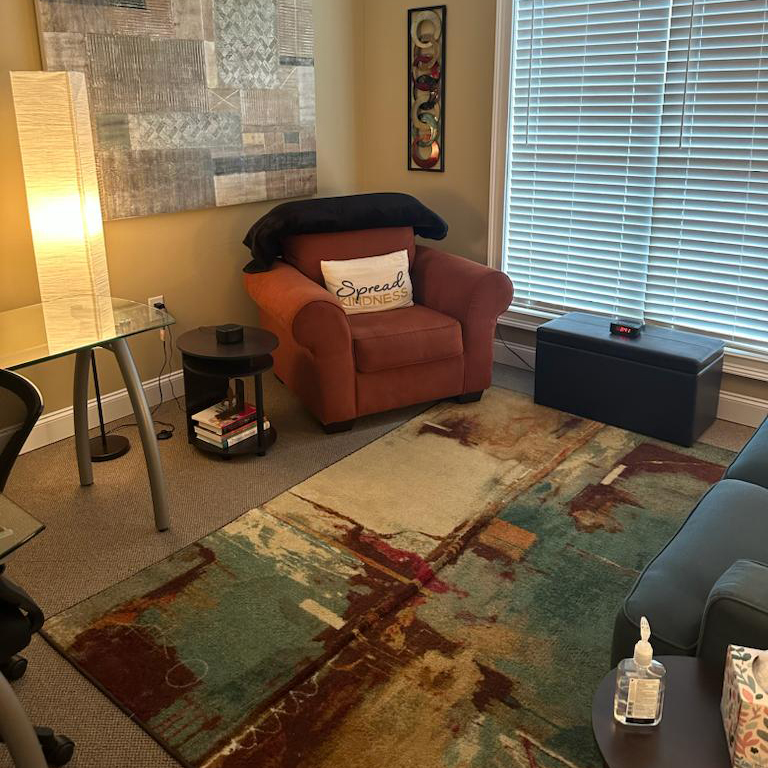
Image resolution: width=768 pixels, height=768 pixels. Identify the location of area rug. (492, 637).